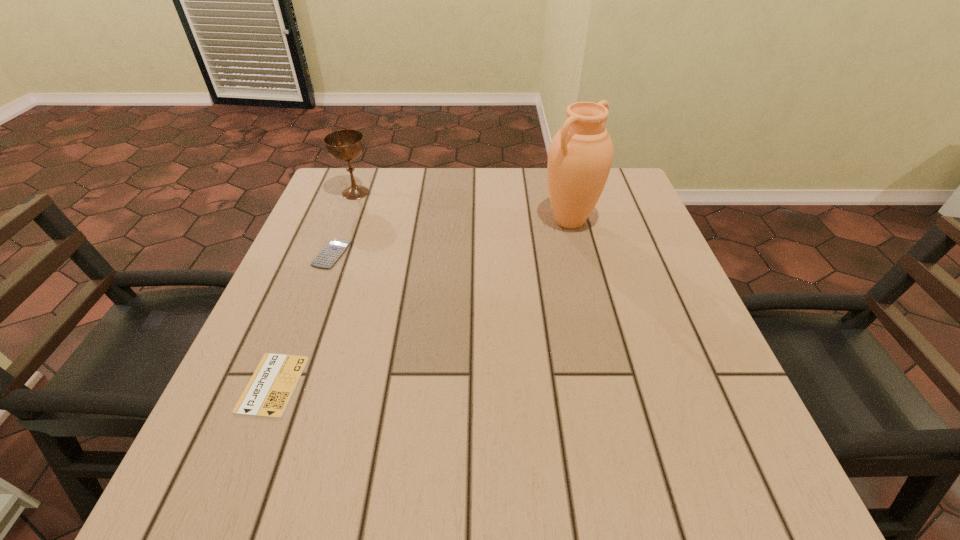
You are a GUI agent. You are given a task and a screenshot of the screen. Output one action in this format:
    pyautogui.click(x=<x>, y=<y>)
    Task: Click on the vacant space at the far edge of the desktop
    
    Given the screenshot: What is the action you would take?
    pyautogui.click(x=405, y=181)

Where is `vacant position at the near edge of the desktop`? vacant position at the near edge of the desktop is located at coordinates [x=584, y=498].

What are the coordinates of `vacant space at the left edge of the desktop` in the screenshot? It's located at (334, 332).

You are a GUI agent. You are given a task and a screenshot of the screen. Output one action in this format:
    pyautogui.click(x=<x>, y=<y>)
    Task: Click on the vacant space at the right edge of the desktop
    The width and height of the screenshot is (960, 540).
    Given the screenshot: What is the action you would take?
    pyautogui.click(x=690, y=401)

I want to click on vacant space at the far right corner of the desktop, so click(630, 214).

This screenshot has height=540, width=960. I want to click on free space between the second tallest object and the shortest object, so (x=314, y=288).

You are a GUI agent. You are given a task and a screenshot of the screen. Output one action in this format:
    pyautogui.click(x=<x>, y=<y>)
    Task: Click on the free area in between the farthest object and the identity card
    The width and height of the screenshot is (960, 540).
    Given the screenshot: What is the action you would take?
    pyautogui.click(x=314, y=288)

At what (x,y) coordinates should I click in order to perform the action: click on free space between the chalice and the urn. Please return your answer as a coordinate pair (x, y). Looking at the image, I should click on (463, 207).

Where is `empty space that is in between the identity card and the tallest object`? The width and height of the screenshot is (960, 540). empty space that is in between the identity card and the tallest object is located at coordinates (421, 303).

Image resolution: width=960 pixels, height=540 pixels. Identify the location of vacant area between the chalice and the urn. (463, 207).